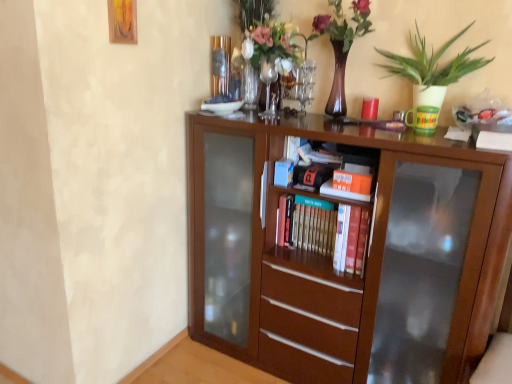
Question: Is matte brown vase with flowers at upper center situated inside hardcover books at center, which is the second book in top-to-bottom order, or outside?

Choices:
 (A) outside
 (B) inside

Answer: (A)

Question: From a real-world perspective, is matte brown vase with flowers at upper center above or below hardcover books at center, placed as the first book when sorted from back to front?

Choices:
 (A) above
 (B) below

Answer: (A)

Question: Estimate the real-world distances between objects in this image. Which object is farther from the matte brown vase with flowers at upper center?

Choices:
 (A) green matte plant at upper right
 (B) orange matte book at center, which is the second book from bottom to top
 (C) wooden picture frame at upper left
 (D) hardcover books at center, placed as the first book when sorted from back to front
 (E) brown wooden bookcase at center

Answer: (C)

Question: Estimate the real-world distances between objects in this image. Which object is farther from the matte brown vase with flowers at upper center?

Choices:
 (A) green matte plant at upper right
 (B) orange matte book at center, which ranks as the 1th book in top-to-bottom order
 (C) hardcover books at center, the 2th book viewed from the front
 (D) wooden picture frame at upper left
 (E) brown wooden bookcase at center

Answer: (D)